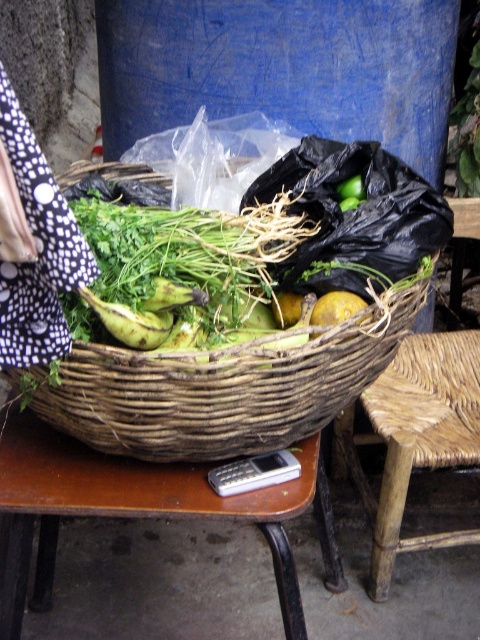
Does brown wooden table at lower center appear over yellow matte potato at center?

Incorrect, brown wooden table at lower center is not positioned above yellow matte potato at center.

Can you confirm if brown wooden table at lower center is shorter than yellow matte potato at center?

Incorrect, brown wooden table at lower center's height does not fall short of yellow matte potato at center's.

Is point (2, 576) less distant than point (331, 307)?

No, it is behind (331, 307).

In order to click on brown wooden table at lower center in this screenshot , I will do (x=136, y=509).

Does woven wood chair at lower right have a larger size compared to yellow matte potato at center?

Yes.

The height and width of the screenshot is (640, 480). Describe the element at coordinates (415, 436) in the screenshot. I see `woven wood chair at lower right` at that location.

Identify the location of woven wood chair at lower right. (415, 436).

This screenshot has width=480, height=640. I want to click on woven wood chair at lower right, so click(x=415, y=436).

Which is behind, point (405, 320) or point (51, 500)?

Positioned behind is point (405, 320).

Between woven brown basket at center and brown wooden table at lower center, which one is positioned higher?

woven brown basket at center

This screenshot has width=480, height=640. What do you see at coordinates (223, 388) in the screenshot? I see `woven brown basket at center` at bounding box center [223, 388].

The width and height of the screenshot is (480, 640). I want to click on woven brown basket at center, so click(223, 388).